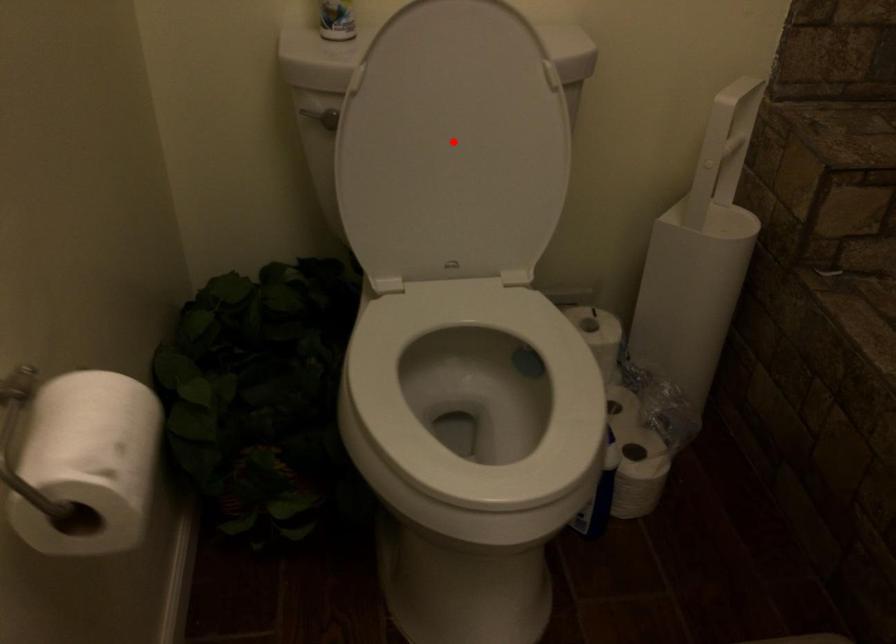
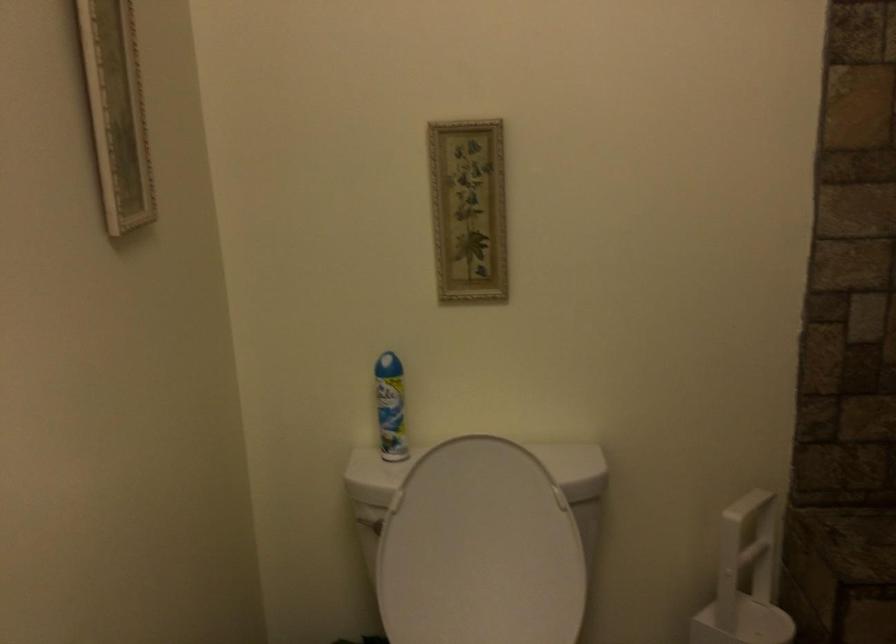
Question: A red point is marked in image1. In image2, is the corresponding 3D point closer to the camera or farther? Reply with the corresponding letter.

Choices:
 (A) The corresponding 3D point is closer.
 (B) The corresponding 3D point is farther.

Answer: (B)